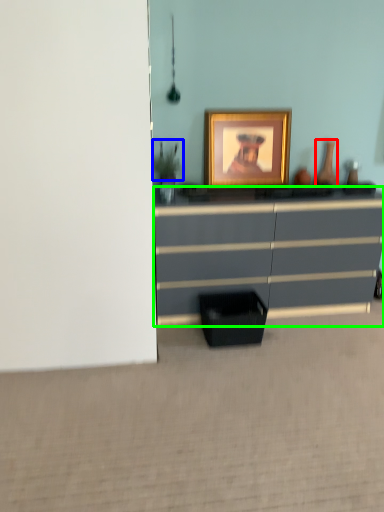
Question: Based on their relative distances, which object is nearer to vase (highlighted by a red box)? Choose from plant (highlighted by a blue box) and chest of drawers (highlighted by a green box).

Choices:
 (A) plant
 (B) chest of drawers

Answer: (B)